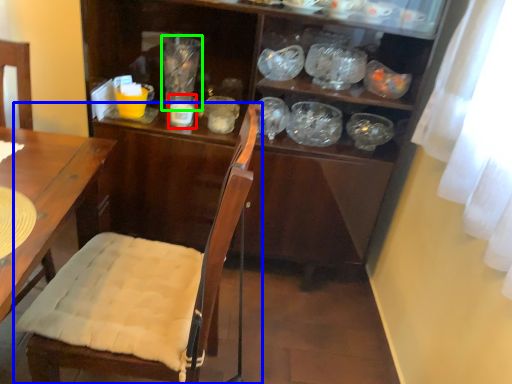
Question: Which object is the farthest from tableware (highlighted by a red box)? Choose among these: chair (highlighted by a blue box) or glass jar (highlighted by a green box).

Choices:
 (A) chair
 (B) glass jar

Answer: (A)